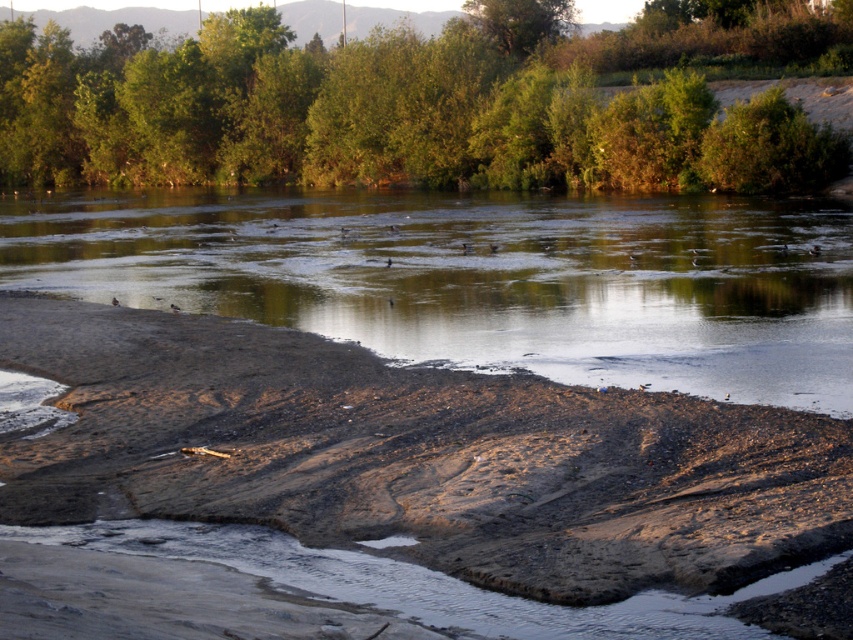
Between point (738, 547) and point (44, 129), which one is positioned behind?

The point (44, 129) is behind.

Describe the element at coordinates (416, 456) in the screenshot. I see `brown sandy beach at lower left` at that location.

This screenshot has width=853, height=640. Describe the element at coordinates (416, 456) in the screenshot. I see `brown sandy beach at lower left` at that location.

The width and height of the screenshot is (853, 640). What are the coordinates of `brown sandy beach at lower left` in the screenshot? It's located at (416, 456).

Can you confirm if brown sandy beach at lower left is positioned below brown dirt at lower center?

Yes, brown sandy beach at lower left is below brown dirt at lower center.

Where is `brown sandy beach at lower left`? The height and width of the screenshot is (640, 853). brown sandy beach at lower left is located at coordinates (416, 456).

I want to click on brown dirt at lower center, so click(x=483, y=276).

Is point (747, 260) closer to camera compared to point (809, 129)?

Yes, it is in front of point (809, 129).

Locate an element on the screen. brown dirt at lower center is located at coordinates (483, 276).